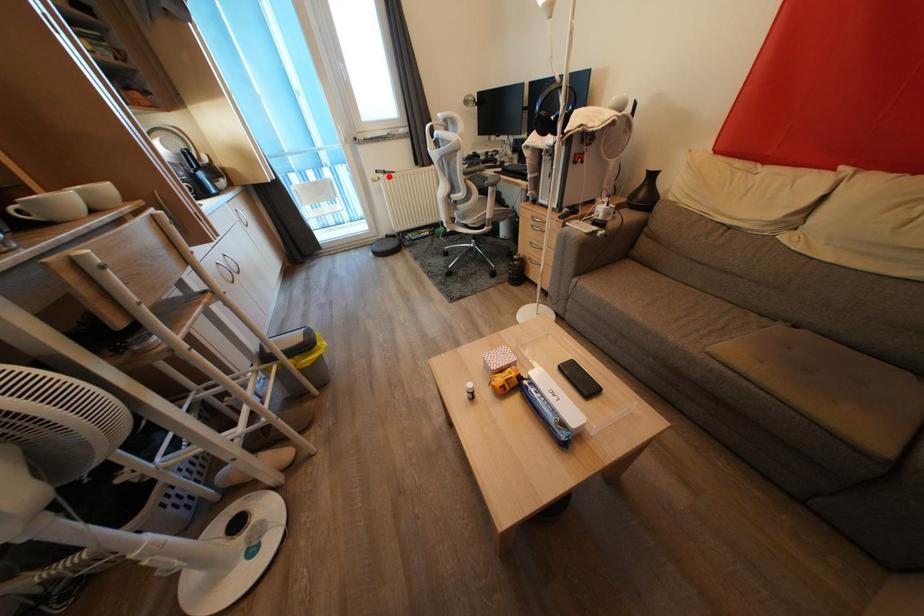
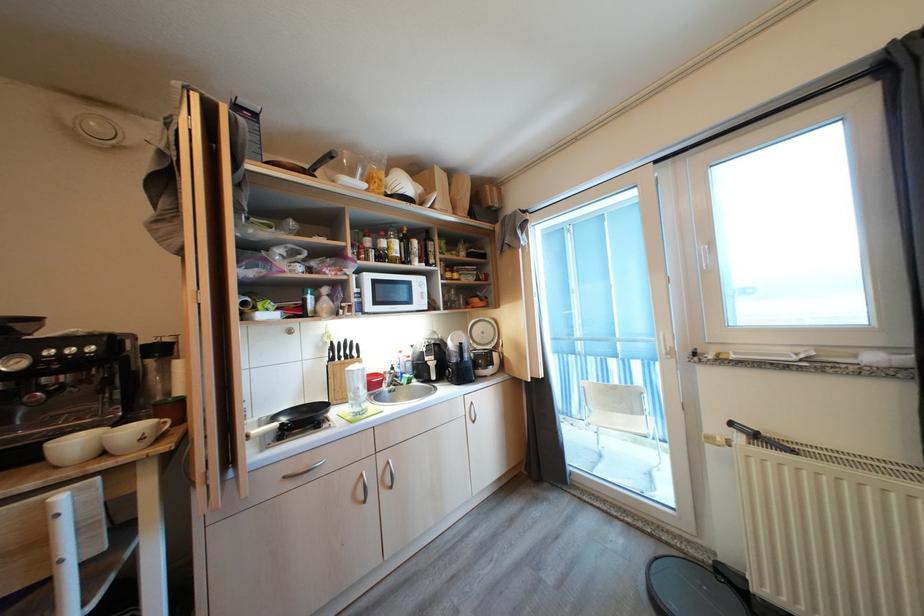
Question: I am providing you with two images of the same scene from different viewpoints. In image1, a red point is highlighted. Considering the same 3D point in image2, which of the following is correct?

Choices:
 (A) It is closer
 (B) It is farther

Answer: (B)